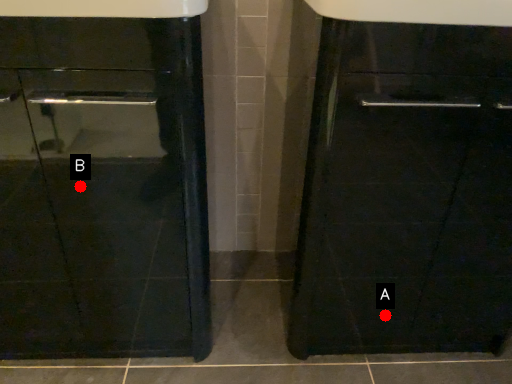
Question: Two points are circled on the image, labeled by A and B beside each circle. Which point is farther to the camera?

Choices:
 (A) A is further
 (B) B is further

Answer: (A)